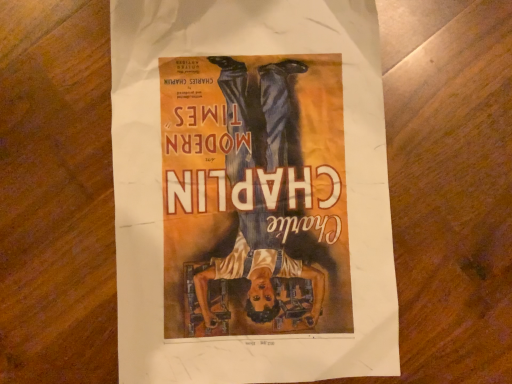
Identify the location of blank space situated above matte paper poster at center (from a real-world perspective). The width and height of the screenshot is (512, 384). (252, 168).